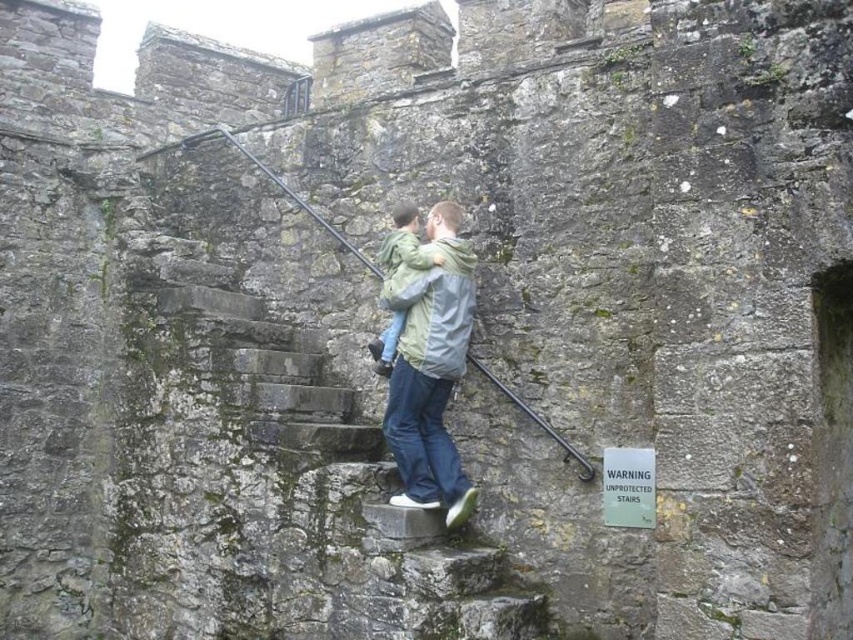
You are standing at the bottom of the stone staircase in the historic structure. You see two points marked on the wall. The first point is at coordinates point [300,605] and the second is at point [408,232]. If you want to reach the point that is closer to you, which coordinate should you head towards?

Point [300,605] is in front of point [408,232], so you should head towards point [300,605] as it is closer to your current position at the bottom of the staircase.

You are a tour guide explaining the historic staircase to visitors. You point out the light green fabric boy at center and the light green fabric at center. Which one is taller?

The light green fabric boy at center is taller than the light green fabric at center.